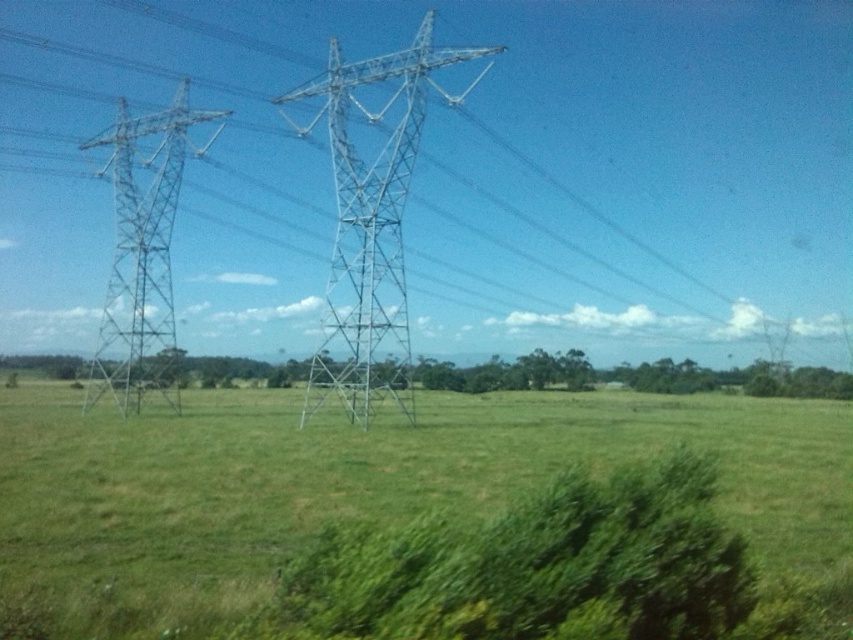
Is metallic silver power line at left positioned at the back of metallic silver tower at center?

Yes, metallic silver power line at left is further from the viewer.

Is point (828, 12) positioned before point (376, 205)?

No.

Does point (445, 1) come farther from viewer compared to point (318, 81)?

Yes, point (445, 1) is farther from viewer.

Identify the location of metallic silver power line at left. (454, 173).

Identify the location of metallic silver power line at left. The width and height of the screenshot is (853, 640). (454, 173).

Which is above, metallic silver power line at left or metallic silver tower at left?

metallic silver tower at left is higher up.

You are a GUI agent. You are given a task and a screenshot of the screen. Output one action in this format:
    pyautogui.click(x=<x>, y=<y>)
    Task: Click on the metallic silver power line at left
    This screenshot has height=640, width=853.
    Given the screenshot: What is the action you would take?
    pyautogui.click(x=454, y=173)

Does point (405, 156) come behind point (201, 113)?

No, (405, 156) is closer to viewer.

The width and height of the screenshot is (853, 640). Identify the location of metallic silver tower at center. (370, 227).

Does point (482, 72) lie in front of point (117, 136)?

No.

Locate an element on the screen. metallic silver tower at center is located at coordinates (370, 227).